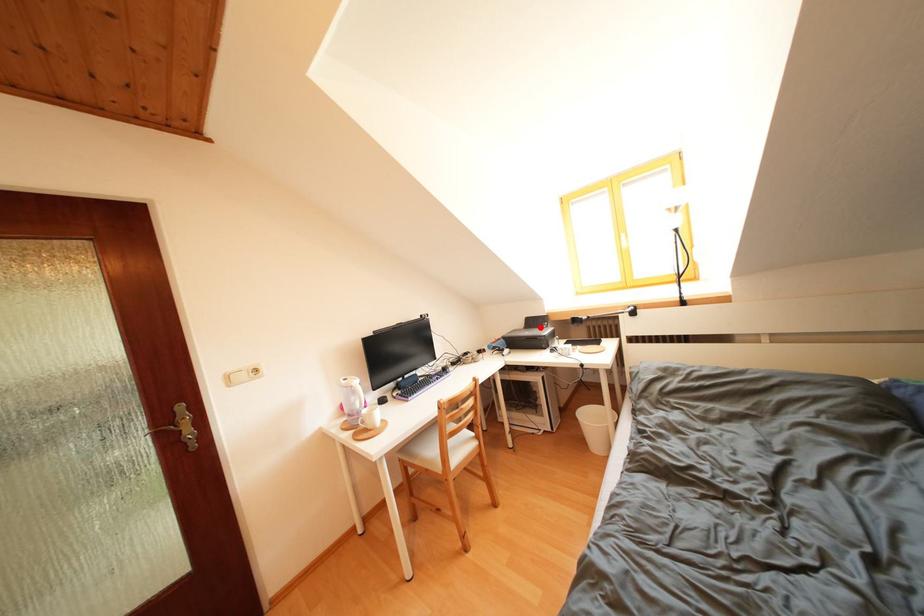
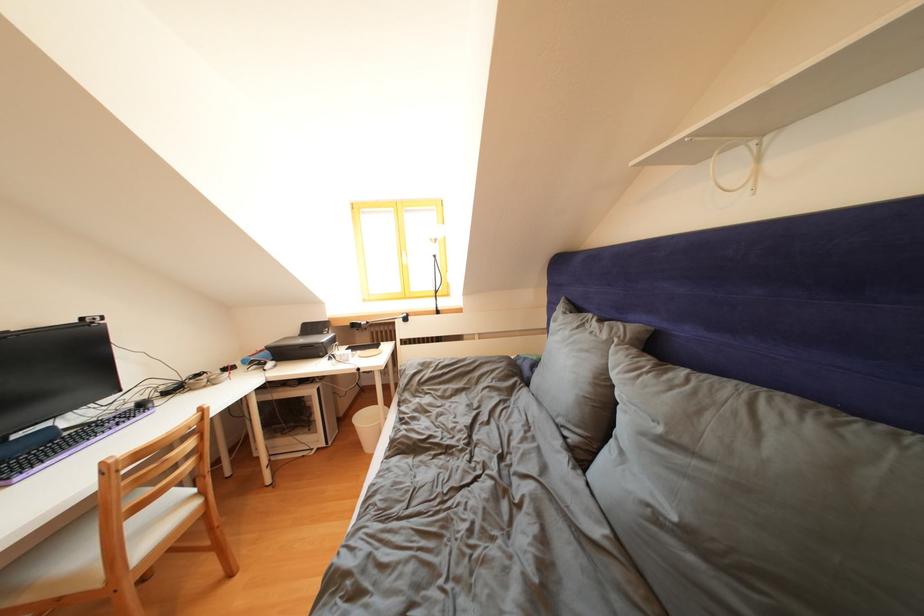
Question: I am providing you with two images of the same scene from different viewpoints. A red point is marked on the first image. Is the red point's position out of view in image 2?

Choices:
 (A) Yes
 (B) No

Answer: (B)